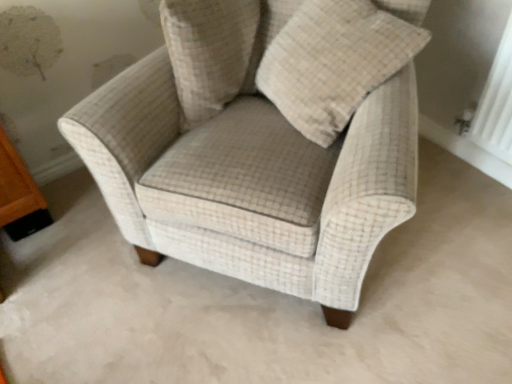
Describe the element at coordinates (334, 62) in the screenshot. The width and height of the screenshot is (512, 384). I see `beige checkered pillow at center` at that location.

Image resolution: width=512 pixels, height=384 pixels. Find the location of `beige checkered armchair at center`. beige checkered armchair at center is located at coordinates (263, 142).

I want to click on beige checkered pillow at upper center, so click(210, 52).

From a real-world perspective, is beige checkered armchair at center on top of beige checkered pillow at center?

No.

From the image's perspective, between beige checkered armchair at center and beige checkered pillow at center, who is located below?

From the image's view, beige checkered armchair at center is below.

Considering the sizes of objects beige checkered armchair at center and beige checkered pillow at center in the image provided, who is shorter, beige checkered armchair at center or beige checkered pillow at center?

Standing shorter between the two is beige checkered pillow at center.

Does beige checkered armchair at center lie in front of beige checkered pillow at center?

Yes, it is.

Which object is positioned more to the right, beige checkered pillow at center or beige checkered pillow at upper center?

beige checkered pillow at center is more to the right.

How distant is beige checkered pillow at center from beige checkered pillow at upper center?

beige checkered pillow at center is 8.77 inches from beige checkered pillow at upper center.

The width and height of the screenshot is (512, 384). Find the location of `throw pillow in front of the beige checkered pillow at upper center`. throw pillow in front of the beige checkered pillow at upper center is located at coordinates (334, 62).

Between beige checkered pillow at center and beige checkered pillow at upper center, which one has smaller width?

With smaller width is beige checkered pillow at upper center.

Visually, is beige checkered pillow at upper center positioned to the left or to the right of beige checkered pillow at center?

From the image, it's evident that beige checkered pillow at upper center is to the left of beige checkered pillow at center.

Is beige checkered pillow at center inside beige checkered pillow at upper center?

No, beige checkered pillow at center is located outside of beige checkered pillow at upper center.

From a real-world perspective, is beige checkered pillow at upper center below beige checkered pillow at center?

Correct, in the physical world, beige checkered pillow at upper center is lower than beige checkered pillow at center.

Between beige checkered pillow at upper center and beige checkered pillow at center, which one has smaller size?

beige checkered pillow at upper center is smaller.

Do you think beige checkered pillow at center is within beige checkered armchair at center, or outside of it?

beige checkered pillow at center is contained in beige checkered armchair at center.

Considering the positions of objects beige checkered pillow at center and beige checkered armchair at center in the image provided, who is more to the right, beige checkered pillow at center or beige checkered armchair at center?

From the viewer's perspective, beige checkered pillow at center appears more on the right side.

From the picture: Who is bigger, beige checkered pillow at center or beige checkered armchair at center?

Bigger between the two is beige checkered armchair at center.

Consider the image. Can you tell me how much beige checkered pillow at center and beige checkered armchair at center differ in facing direction?

They differ by 38.4 degrees in their facing directions.

Can you confirm if beige checkered armchair at center is smaller than beige checkered pillow at upper center?

Incorrect, beige checkered armchair at center is not smaller in size than beige checkered pillow at upper center.

Does beige checkered armchair at center contain beige checkered pillow at upper center?

Yes.

Is point (176, 166) farther from viewer compared to point (217, 44)?

No, (176, 166) is in front of (217, 44).

Which object is closer to the camera, beige checkered pillow at upper center or beige checkered armchair at center?

beige checkered armchair at center.

Can you confirm if beige checkered pillow at upper center is positioned to the left of beige checkered armchair at center?

Yes.

Can you confirm if beige checkered pillow at upper center is bigger than beige checkered armchair at center?

Incorrect, beige checkered pillow at upper center is not larger than beige checkered armchair at center.

Considering the positions of points (172, 60) and (234, 175), is point (172, 60) farther from camera compared to point (234, 175)?

That is True.

In order to click on throw pillow above the beige checkered armchair at center (from a real-world perspective) in this screenshot , I will do `click(334, 62)`.

I want to click on pillow below the beige checkered pillow at center (from a real-world perspective), so click(x=210, y=52).

When comparing their distances from beige checkered pillow at upper center, does beige checkered pillow at center or beige checkered armchair at center seem closer?

beige checkered armchair at center is positioned closer to the anchor beige checkered pillow at upper center.

Which object lies nearer to the anchor point beige checkered pillow at center, beige checkered pillow at upper center or beige checkered armchair at center?

Based on the image, beige checkered armchair at center appears to be nearer to beige checkered pillow at center.

When comparing their distances from beige checkered armchair at center, does beige checkered pillow at upper center or beige checkered pillow at center seem closer?

beige checkered pillow at center lies closer to beige checkered armchair at center than the other object.

In the scene shown: Considering their positions, is beige checkered pillow at center positioned further to beige checkered armchair at center than beige checkered pillow at upper center?

Based on the image, beige checkered pillow at upper center appears to be further to beige checkered armchair at center.

Looking at the image, which one is located closer to beige checkered pillow at upper center, beige checkered armchair at center or beige checkered pillow at center?

beige checkered armchair at center lies closer to beige checkered pillow at upper center than the other object.

When comparing their distances from beige checkered pillow at center, does beige checkered armchair at center or beige checkered pillow at upper center seem further?

beige checkered pillow at upper center is positioned further to the anchor beige checkered pillow at center.

At what (x,y) coordinates should I click in order to perform the action: click on throw pillow positioned between beige checkered armchair at center and beige checkered pillow at upper center from near to far. Please return your answer as a coordinate pair (x, y). This screenshot has height=384, width=512. Looking at the image, I should click on (334, 62).